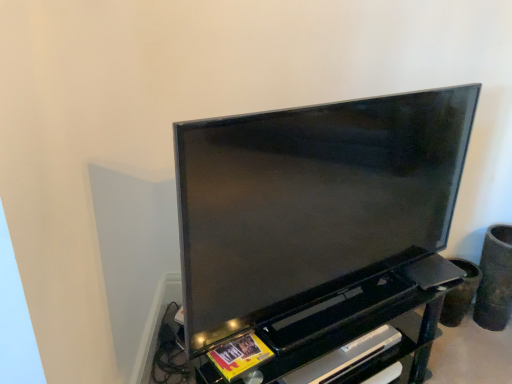
What is the approximate width of black glossy entertainment center at center?

black glossy entertainment center at center is 23.91 inches in width.

The image size is (512, 384). I want to click on black plastic shelf at lower center, so click(409, 328).

In terms of height, does matte black tv at center look taller or shorter compared to black glossy entertainment center at center?

matte black tv at center is taller than black glossy entertainment center at center.

Can you tell me how much matte black tv at center and black glossy entertainment center at center differ in facing direction?

There is a 0.000951-degree angle between the facing directions of matte black tv at center and black glossy entertainment center at center.

From the image's perspective, which object appears higher, matte black tv at center or black glossy entertainment center at center?

matte black tv at center.

Are matte black tv at center and black glossy entertainment center at center far apart?

matte black tv at center is actually quite close to black glossy entertainment center at center.

Is matte black tv at center not within black plastic shelf at lower center?

Yes.

From the image's perspective, would you say matte black tv at center is positioned over black plastic shelf at lower center?

Yes, from the image's perspective, matte black tv at center is on top of black plastic shelf at lower center.

From a real-world perspective, which object stands above the other?

From a 3D spatial view, matte black tv at center is above.

Which point is more distant from viewer, (252,254) or (420,316)?

The point (420,316) is farther from the camera.

From the picture: Looking at the image, does black plastic shelf at lower center seem bigger or smaller compared to black glossy entertainment center at center?

Considering their sizes, black plastic shelf at lower center takes up less space than black glossy entertainment center at center.

Is black plastic shelf at lower center directly adjacent to black glossy entertainment center at center?

They are not placed beside each other.

Between black plastic shelf at lower center and black glossy entertainment center at center, which one has smaller width?

Thinner between the two is black plastic shelf at lower center.

From the image's perspective, is black plastic shelf at lower center on matte black tv at center?

No, from the image's perspective, black plastic shelf at lower center is not over matte black tv at center.

Considering the positions of objects black plastic shelf at lower center and matte black tv at center in the image provided, who is behind, black plastic shelf at lower center or matte black tv at center?

black plastic shelf at lower center is more distant.

Identify the location of television that appears in front of the black plastic shelf at lower center. The width and height of the screenshot is (512, 384). (312, 202).

Is black plastic shelf at lower center facing away from matte black tv at center?

No, matte black tv at center is not at the back of black plastic shelf at lower center.

Which is behind, point (364, 311) or point (345, 183)?

Positioned behind is point (364, 311).

Is black glossy entertainment center at center taller than matte black tv at center?

No.

Which is more to the right, black glossy entertainment center at center or matte black tv at center?

From the viewer's perspective, matte black tv at center appears more on the right side.

Can you tell me how much black glossy entertainment center at center and matte black tv at center differ in facing direction?

The angular difference between black glossy entertainment center at center and matte black tv at center is 0.000951 degrees.

Is black plastic shelf at lower center a part of black glossy entertainment center at center?

Yes, black plastic shelf at lower center can be found within black glossy entertainment center at center.

Consider the image. From a real-world perspective, is black glossy entertainment center at center physically located above or below black plastic shelf at lower center?

Clearly, from a real-world perspective, black glossy entertainment center at center is below black plastic shelf at lower center.

Is black glossy entertainment center at center facing away from black plastic shelf at lower center?

Yes, black glossy entertainment center at center is facing away from black plastic shelf at lower center.

Is black glossy entertainment center at center shorter than black plastic shelf at lower center?

No.

You are a GUI agent. You are given a task and a screenshot of the screen. Output one action in this format:
    pyautogui.click(x=<x>, y=<y>)
    Task: Click on the entertainment center on the left side of matte black tv at center
    
    Given the screenshot: What is the action you would take?
    pyautogui.click(x=324, y=334)

Locate an element on the screen. The height and width of the screenshot is (384, 512). shelf located below the matte black tv at center (from the image's perspective) is located at coordinates (409, 328).

Based on the photo, when comparing their distances from black glossy entertainment center at center, does black plastic shelf at lower center or matte black tv at center seem further?

black plastic shelf at lower center lies further to black glossy entertainment center at center than the other object.

Estimate the real-world distances between objects in this image. Which object is closer to black plastic shelf at lower center, black glossy entertainment center at center or matte black tv at center?

black glossy entertainment center at center lies closer to black plastic shelf at lower center than the other object.

When comparing their distances from matte black tv at center, does black plastic shelf at lower center or black glossy entertainment center at center seem further?

The object further to matte black tv at center is black plastic shelf at lower center.

When comparing their distances from matte black tv at center, does black glossy entertainment center at center or black plastic shelf at lower center seem closer?

The object closer to matte black tv at center is black glossy entertainment center at center.

When comparing their distances from black plastic shelf at lower center, does matte black tv at center or black glossy entertainment center at center seem further?

matte black tv at center is positioned further to the anchor black plastic shelf at lower center.

Based on their spatial positions, is matte black tv at center or black plastic shelf at lower center further from black glossy entertainment center at center?

black plastic shelf at lower center is positioned further to the anchor black glossy entertainment center at center.

Where is `entertainment center between matte black tv at center and black plastic shelf at lower center in the up-down direction`? This screenshot has width=512, height=384. entertainment center between matte black tv at center and black plastic shelf at lower center in the up-down direction is located at coordinates (324, 334).